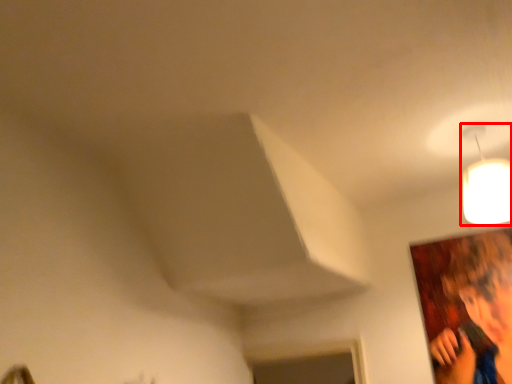
Question: Where is lamp (annotated by the red box) located in relation to person in the image?

Choices:
 (A) right
 (B) left

Answer: (B)